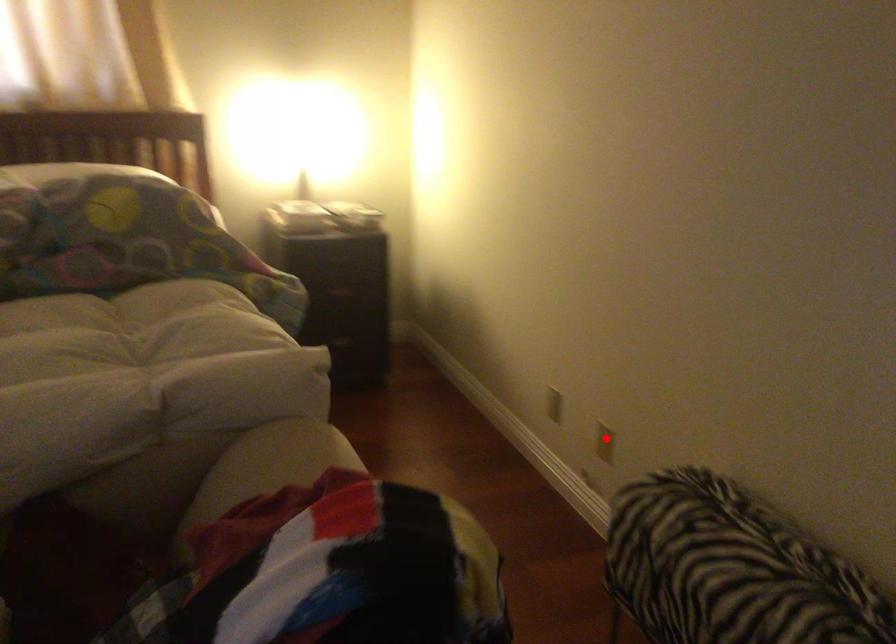
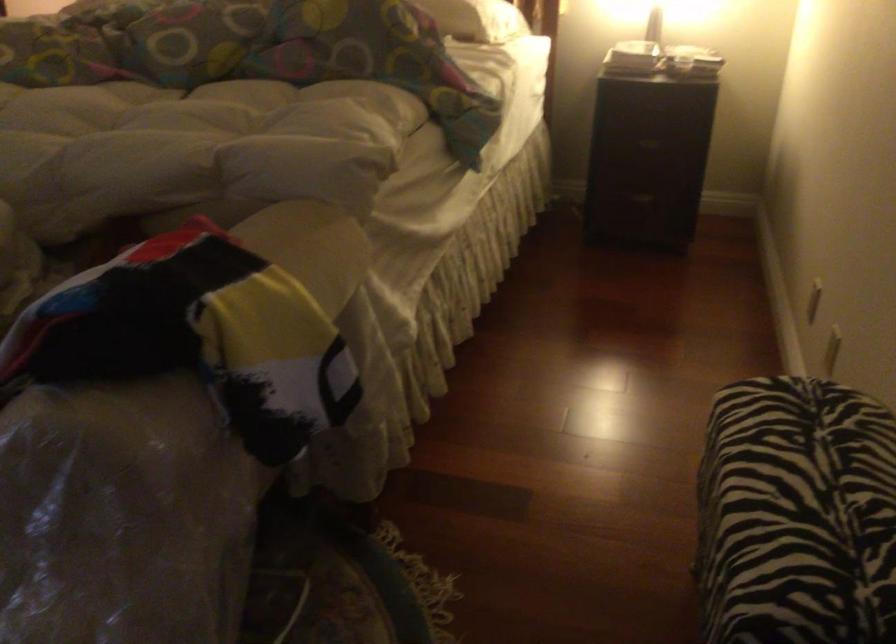
Find the pixel in the second image that matches the highlighted location in the first image.

(831, 352)